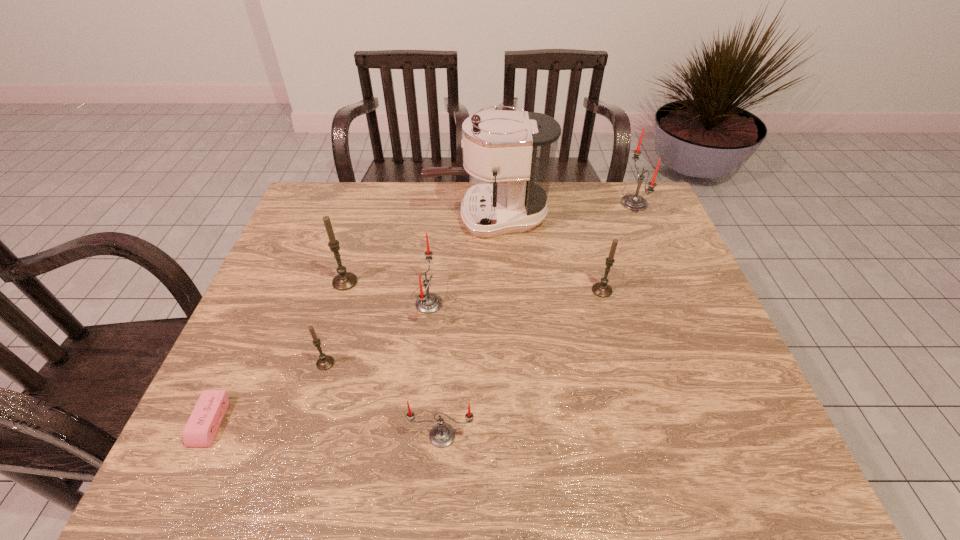
Choose which candle is the third nearest neighbor to the second nearest candle. Please provide its 2D coordinates. Your answer should be formatted as a tuple, i.e. [(x, y)], where the tuple contains the x and y coordinates of a point satisfying the conditions above.

[(442, 435)]

You are a GUI agent. You are given a task and a screenshot of the screen. Output one action in this format:
    pyautogui.click(x=<x>, y=<y>)
    Task: Click on the third closest candle relative to the smallest red candle
    Image resolution: width=960 pixels, height=540 pixels.
    Given the screenshot: What is the action you would take?
    pyautogui.click(x=344, y=280)

Locate which red candle is the second closest to the second farthest red candle. Please provide its 2D coordinates. Your answer should be formatted as a tuple, i.e. [(x, y)], where the tuple contains the x and y coordinates of a point satisfying the conditions above.

[(632, 202)]

The width and height of the screenshot is (960, 540). Identify the location of the third closest red candle relative to the third nearest object. (632, 202).

Identify which gray candle is located as the second nearest to the biggest gray candle. Please provide its 2D coordinates. Your answer should be formatted as a tuple, i.e. [(x, y)], where the tuple contains the x and y coordinates of a point satisfying the conditions above.

[(601, 289)]

You are a GUI agent. You are given a task and a screenshot of the screen. Output one action in this format:
    pyautogui.click(x=<x>, y=<y>)
    Task: Click on the gray candle that is the third closest to the tallest object
    The image size is (960, 540).
    Given the screenshot: What is the action you would take?
    pyautogui.click(x=325, y=362)

Image resolution: width=960 pixels, height=540 pixels. In order to click on free point that satisfies the following two spatial constraints: 1. on the front-facing side of the white coffee maker; 2. on the front-facing side of the smallest red candle in this screenshot , I will do `click(492, 435)`.

I want to click on free location that satisfies the following two spatial constraints: 1. on the front-facing side of the second smallest gray candle; 2. on the right side of the tallest object, so click(490, 291).